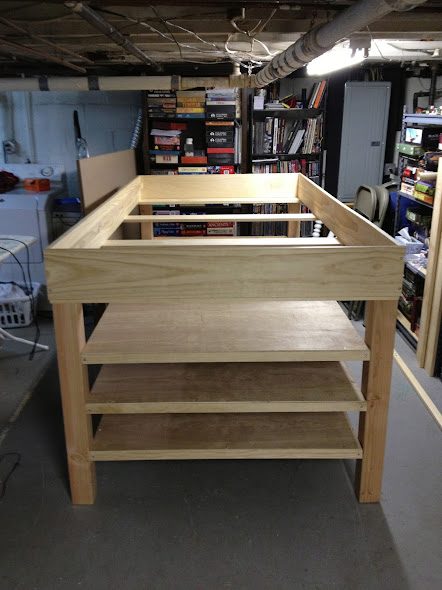
Where is `light`? Image resolution: width=442 pixels, height=590 pixels. light is located at coordinates (334, 61).